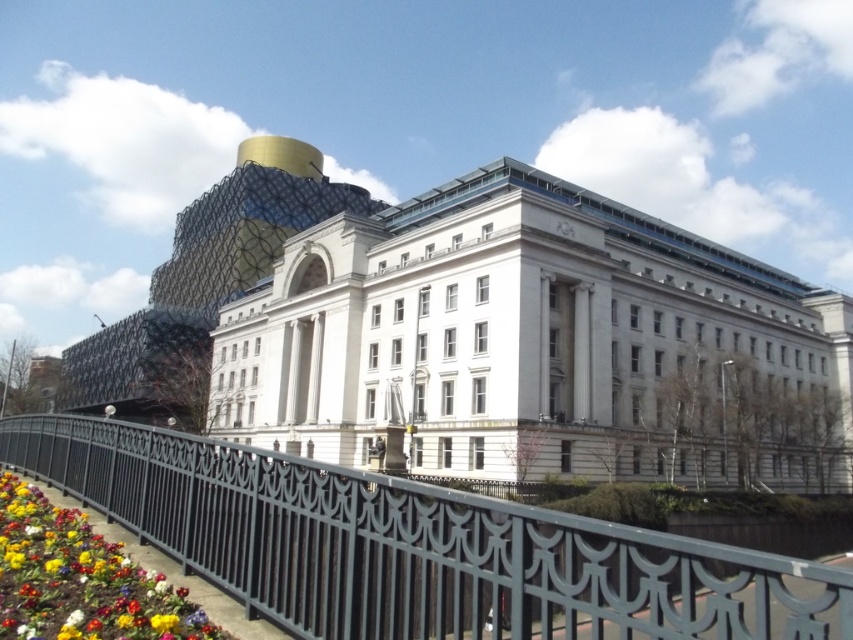
You are an architect analyzing the spatial relationship between the white stone building at center and the multicolored fabric flower at lower left. Which object is wider?

The white stone building at center is wider than the multicolored fabric flower at lower left.

You are standing at the multicolored fabric flower at lower left and want to reach the black wrought iron railing at center. The path between them is straight. If you walk at a speed of 3 feet per second, how many seconds will it take you to reach the railing?

The black wrought iron railing at center is 31.69 feet from the multicolored fabric flower at lower left. At a speed of 3 feet per second, it would take approximately 10.56 seconds to reach the railing.

You are an architect visiting the site and need to determine which object at the center of the image is larger. Which one is bigger between the white stone building at center and the black wrought iron railing at center?

The white stone building at center is bigger than the black wrought iron railing at center according to the description.